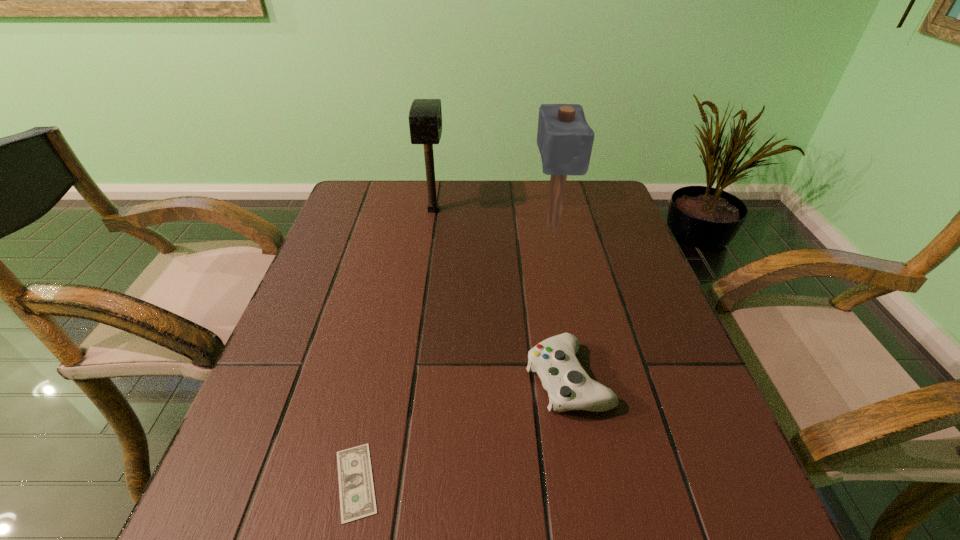
This screenshot has height=540, width=960. Identify the location of vacant space that satisfies the following two spatial constraints: 1. on the back side of the right mallet; 2. on the left side of the money. (410, 227).